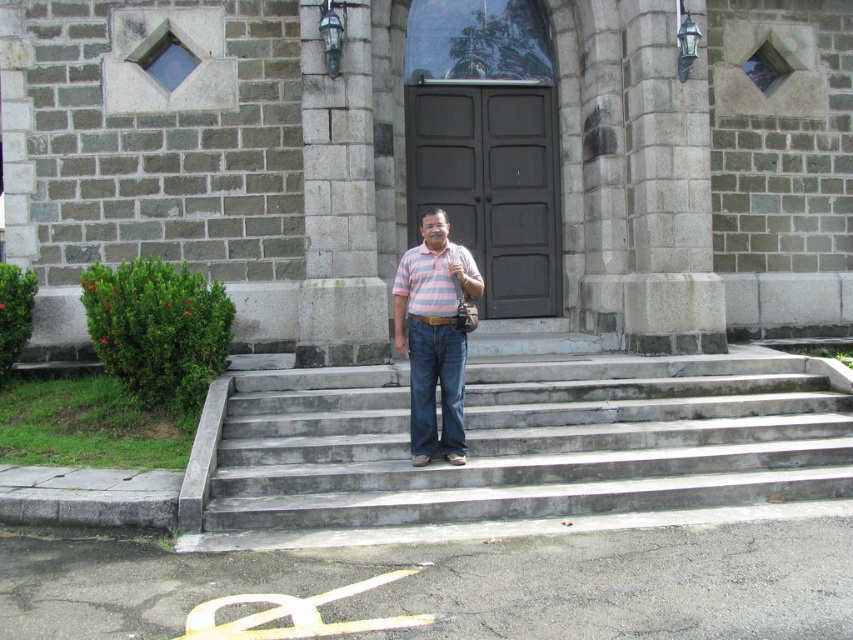
Question: Which point is closer to the camera?

Choices:
 (A) pink striped shirt at center
 (B) pink striped polo shirt at center

Answer: (A)

Question: Is dark blue denim jeans at center below pink striped polo shirt at center?

Choices:
 (A) yes
 (B) no

Answer: (A)

Question: Does pink striped shirt at center appear on the right side of pink striped polo shirt at center?

Choices:
 (A) yes
 (B) no

Answer: (B)

Question: Which point is farther to the camera?

Choices:
 (A) (445, 332)
 (B) (135, 202)

Answer: (B)

Question: Can you confirm if pink striped shirt at center is positioned to the right of dark blue denim jeans at center?

Choices:
 (A) no
 (B) yes

Answer: (A)

Question: Which object is closer to the camera taking this photo?

Choices:
 (A) gray stone church at center
 (B) pink striped polo shirt at center
 (C) pink striped shirt at center
 (D) dark blue denim jeans at center

Answer: (C)